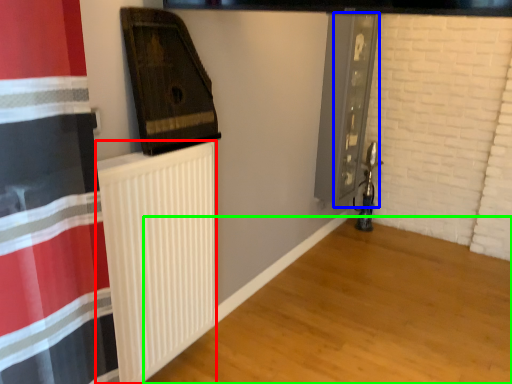
Question: Based on their relative distances, which object is nearer to radiator (highlighted by a red box)? Choose from screen door (highlighted by a blue box) and wood (highlighted by a green box).

Choices:
 (A) screen door
 (B) wood

Answer: (B)